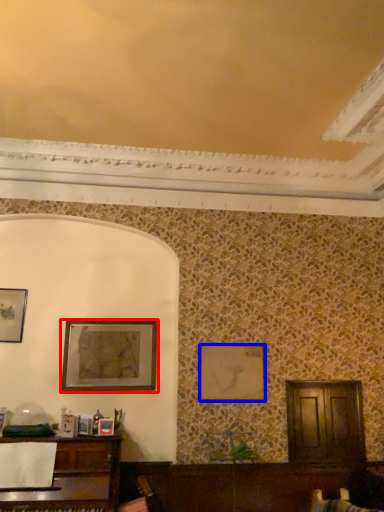
Question: Which object appears farthest to the camera in this image, picture frame (highlighted by a red box) or picture frame (highlighted by a blue box)?

Choices:
 (A) picture frame
 (B) picture frame

Answer: (B)